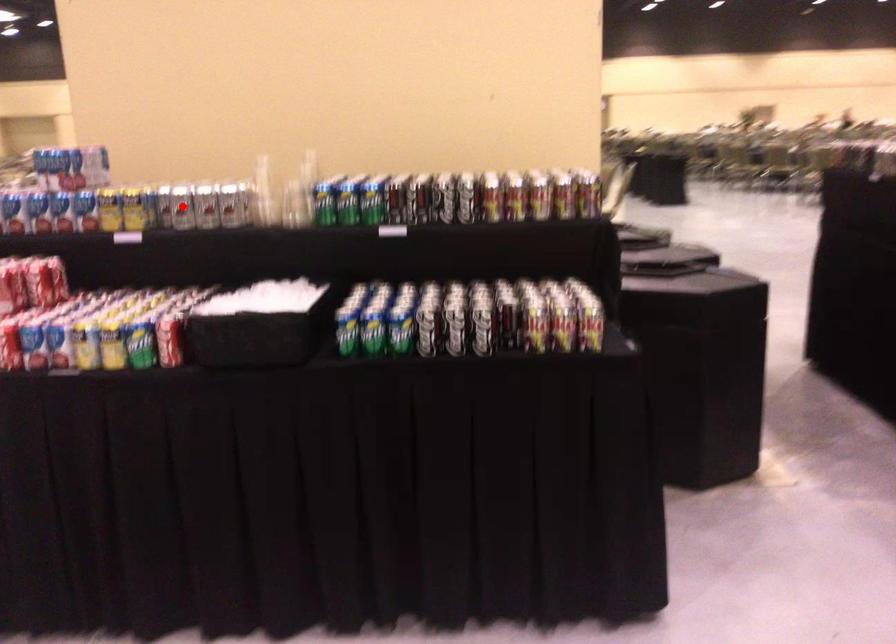
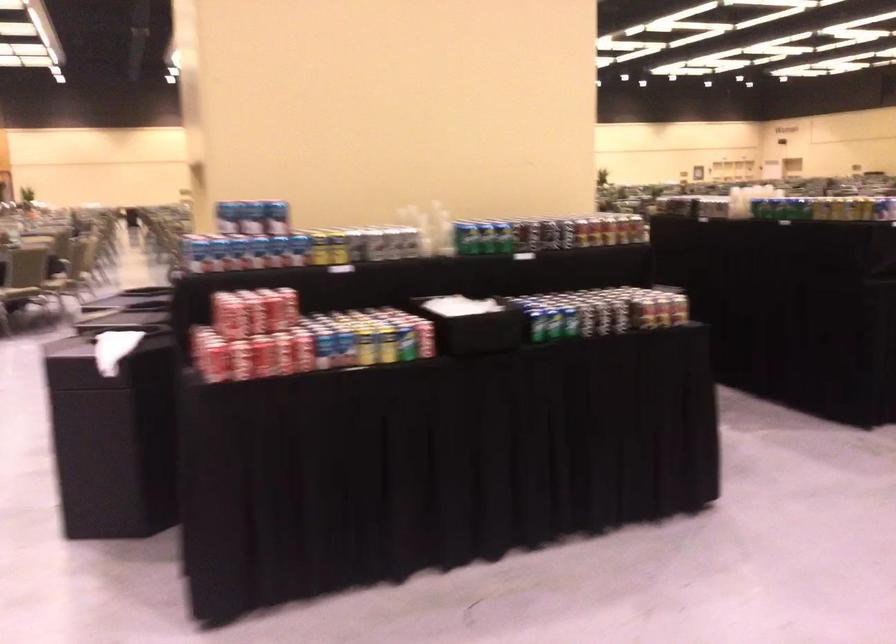
Question: I am providing you with two images of the same scene from different viewpoints. Image1 has a red point marked. In image2, the corresponding 3D location appears at what relative position? Reply with the corresponding letter.

Choices:
 (A) Closer
 (B) Farther

Answer: (B)